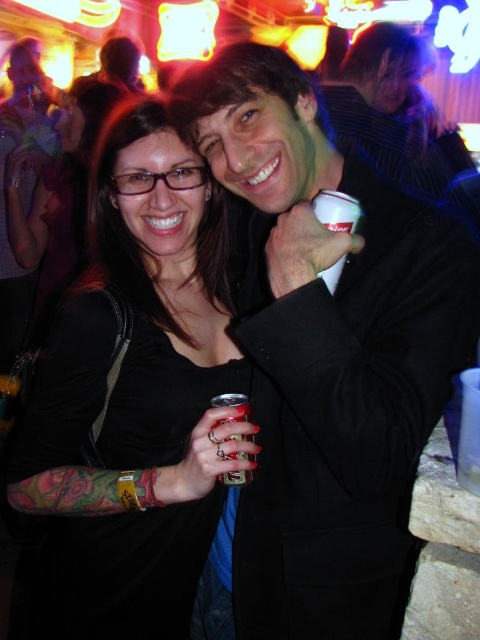
You are standing in the bar and want to hand a drink to the person wearing the matte black jacket at center. Based on their position, where should you approach from?

The matte black jacket at center is located at point [324,362], so you should approach from the left side to hand them the drink since their right hand is free.

You are a photographer at the bar and want to ensure both the matte black jacket at center and the matte black shirt at center are clearly visible in the photo. Given their height difference, which one might you need to adjust your camera angle to focus on more carefully?

The matte black jacket at center is much taller than the matte black shirt at center, so you might need to adjust your camera angle to focus on the matte black shirt at center more carefully to ensure it is not overshadowed by the taller jacket.